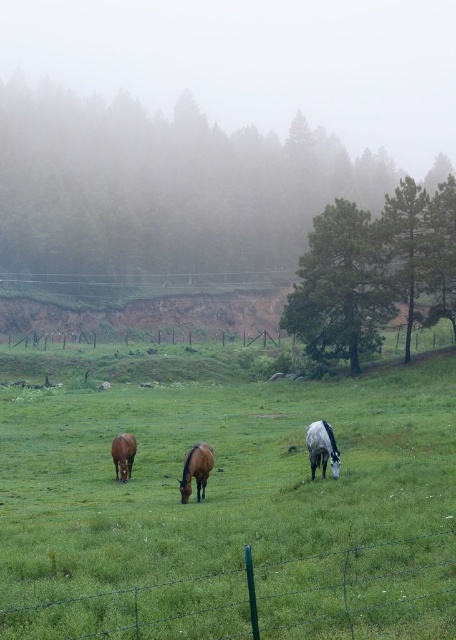
You are a photographer standing at the edge of the pasture. You want to take a photo that includes both the green wire fence at lower center and the brown glossy horse at center. Which object will appear larger in the photo?

The green wire fence at lower center will appear larger in the photo because it is bigger than the brown glossy horse at center according to the description.

You are a photographer standing at the edge of the pasture near the wire fence. You want to take a photo of the brown glossy horse at center and the brown glossy horse at lower left. Based on their positions, which horse would appear higher in the photo?

The brown glossy horse at center would appear higher in the photo because it is positioned above the brown glossy horse at lower left.